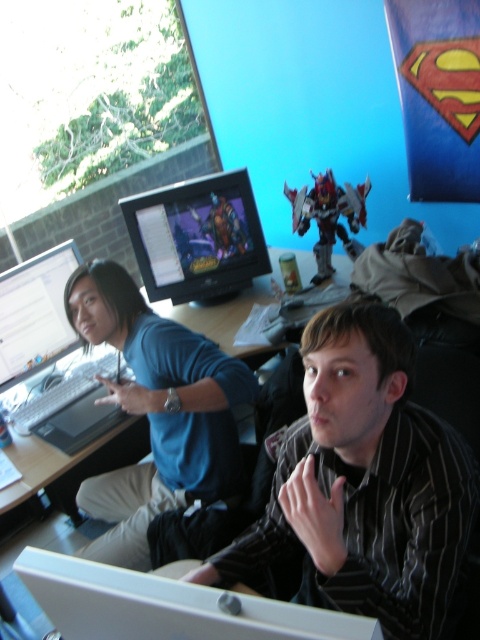
You are a delivery person trying to place a small package between the matte blue shirt at left and the matte black monitor at left. The package is 18 inches long. Can you fit it between them?

The distance between the matte blue shirt at left and the matte black monitor at left is 19.07 inches, so the 18 inches long package can fit between them.

In the scene shown: You are a photographer setting up a shoot in this room. You want to ensure both the striped shirt at center and the matte black monitor at center are clearly visible in your photo. Which object should you focus on first to ensure proper exposure, considering their size?

The striped shirt at center is larger in size than the matte black monitor at center, so focusing on the larger striped shirt at center first will help balance the exposure for both objects.